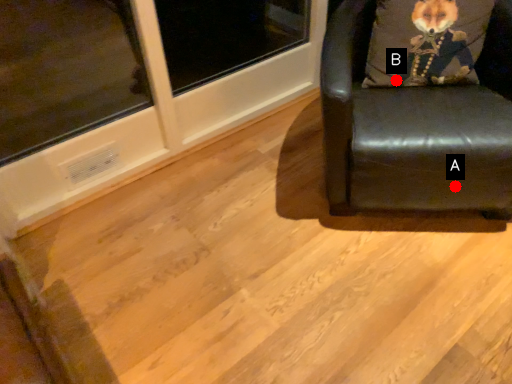
Question: Two points are circled on the image, labeled by A and B beside each circle. Which of the following is the closest to the observer?

Choices:
 (A) A is closer
 (B) B is closer

Answer: (A)